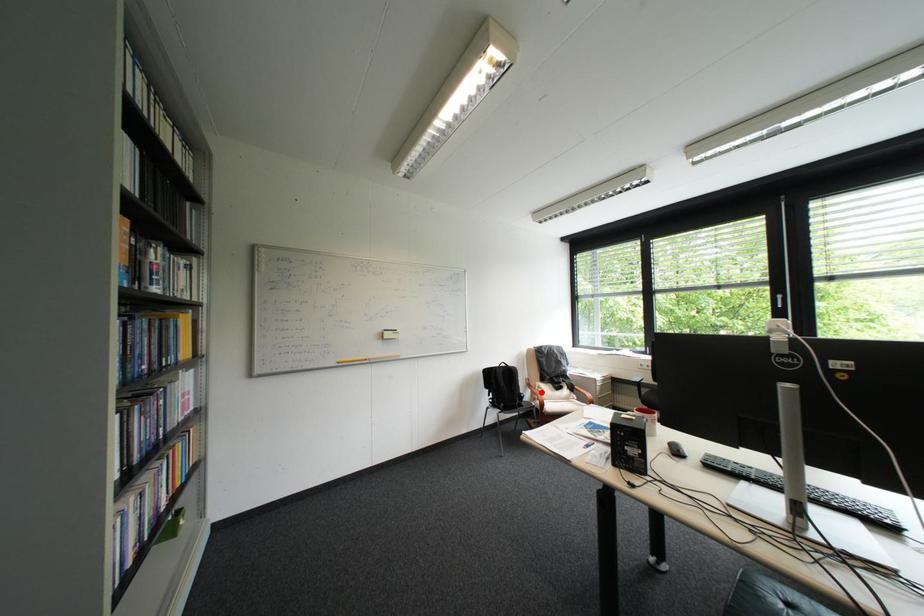
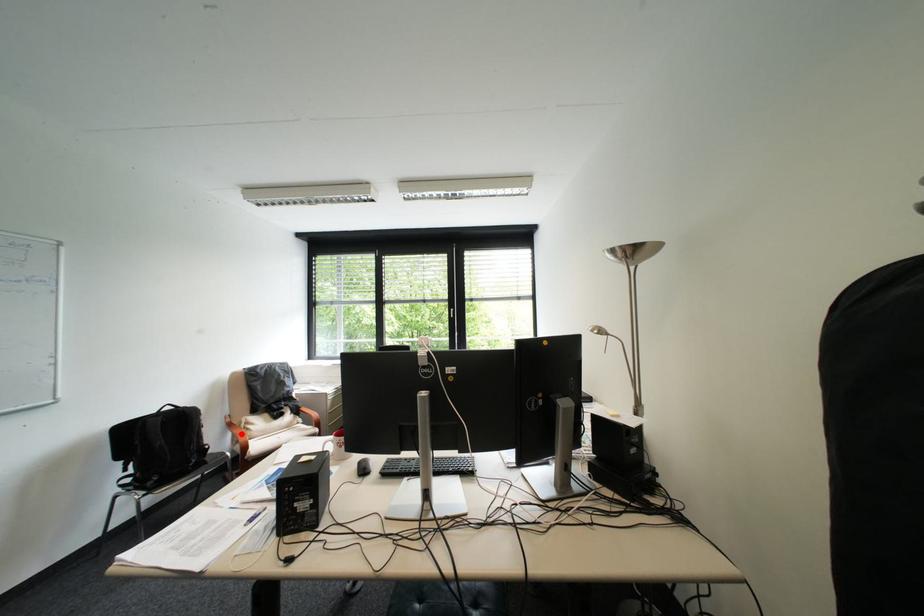
I am providing you with two images of the same scene from different viewpoints. A red point is marked on the first image and another point is marked on the second image. Is the red point in image1 aligned with the point shown in image2?

Yes